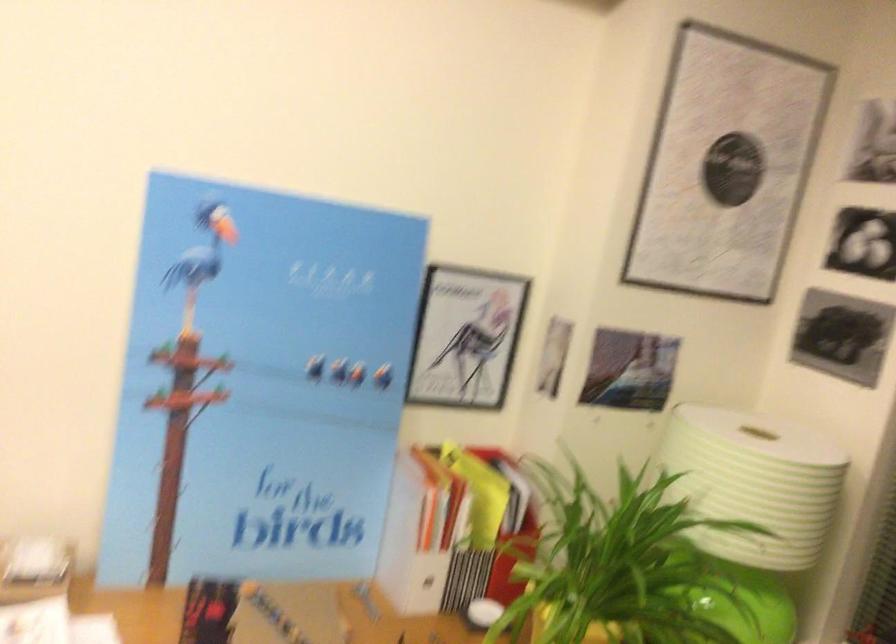
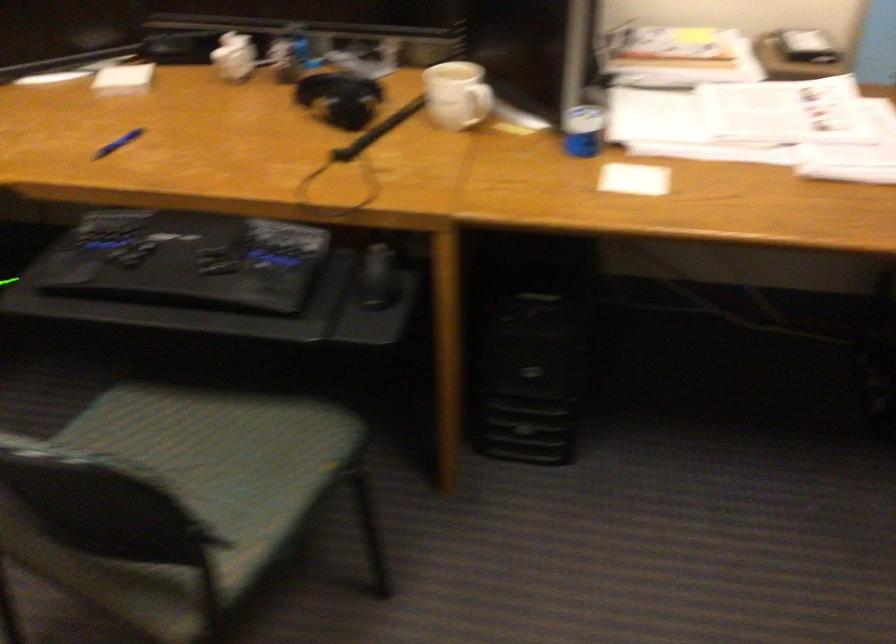
Based on the photo, how did the camera likely rotate?

The rotation direction of the camera is left-down.